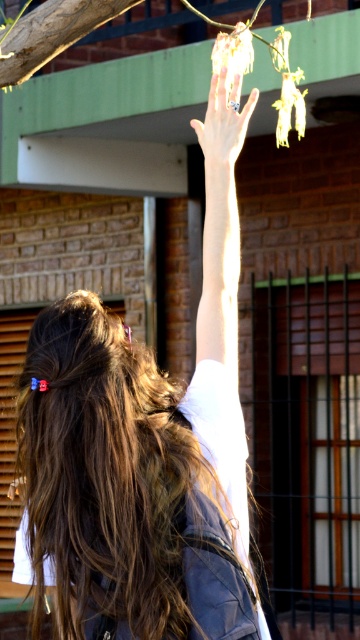
Question: Can you confirm if light brown hair at upper center is thinner than silver metallic ring at upper center?

Choices:
 (A) no
 (B) yes

Answer: (A)

Question: Which object appears closest to the camera in this image?

Choices:
 (A) light brown hair at upper center
 (B) silver metallic ring at upper center

Answer: (A)

Question: Can you confirm if silver metallic ring at upper center is thinner than matte black hand at upper center?

Choices:
 (A) yes
 (B) no

Answer: (A)

Question: Which object is positioned farthest from the silver metallic ring at upper center?

Choices:
 (A) light brown hair at upper center
 (B) matte black hand at upper center

Answer: (B)

Question: Is light brown hair at upper center to the right of silver metallic ring at upper center from the viewer's perspective?

Choices:
 (A) yes
 (B) no

Answer: (B)

Question: Which point is closer to the camera taking this photo?

Choices:
 (A) (20, 483)
 (B) (249, 113)
 (C) (191, 529)

Answer: (C)